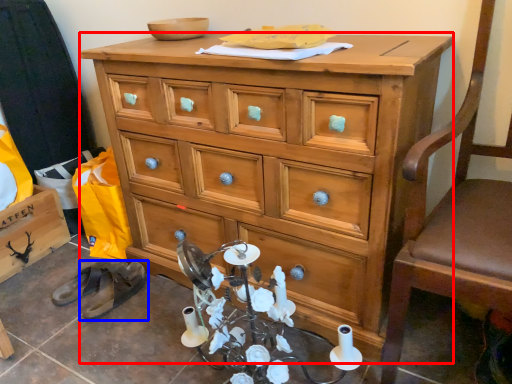
Question: Which object is closer to the camera taking this photo, chest of drawers (highlighted by a red box) or footwear (highlighted by a blue box)?

Choices:
 (A) chest of drawers
 (B) footwear

Answer: (A)